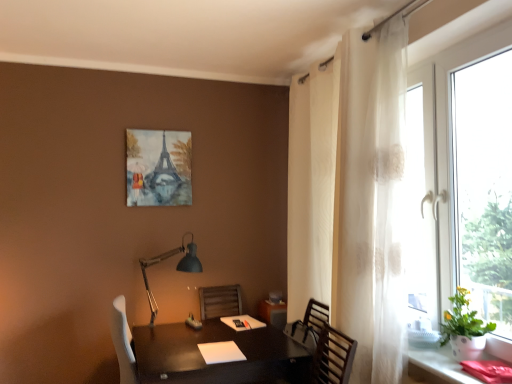
You are a GUI agent. You are given a task and a screenshot of the screen. Output one action in this format:
    pyautogui.click(x=<x>, y=<y>)
    Task: Click on the vacant area on top of matte black desk at lower right (from a real-world perspective)
    The height and width of the screenshot is (384, 512).
    Given the screenshot: What is the action you would take?
    pyautogui.click(x=462, y=360)